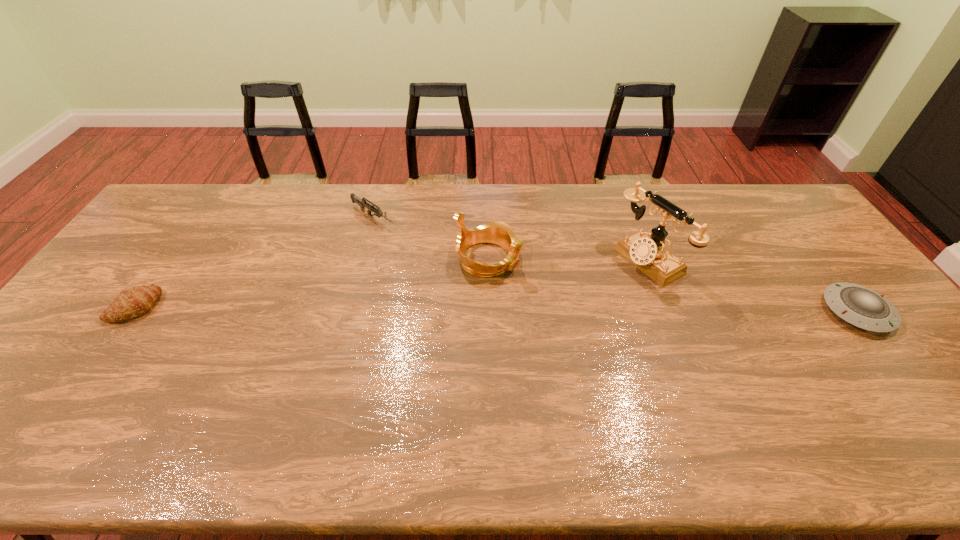
Locate an element on the screen. The width and height of the screenshot is (960, 540). free spot on the desktop that is between the leftmost object and the shortest object and is positioned aimed along the barrel of the farthest object is located at coordinates (512, 309).

Locate an element on the screen. The image size is (960, 540). vacant space on the desktop that is between the leftmost object and the shortest object and is positioned at the front emblem of the tiara is located at coordinates (588, 309).

At what (x,y) coordinates should I click in order to perform the action: click on free space on the desktop that is between the leftmost object and the shortest object and is positioned on the dial of the tallest object. Please return your answer as a coordinate pair (x, y). Looking at the image, I should click on (558, 309).